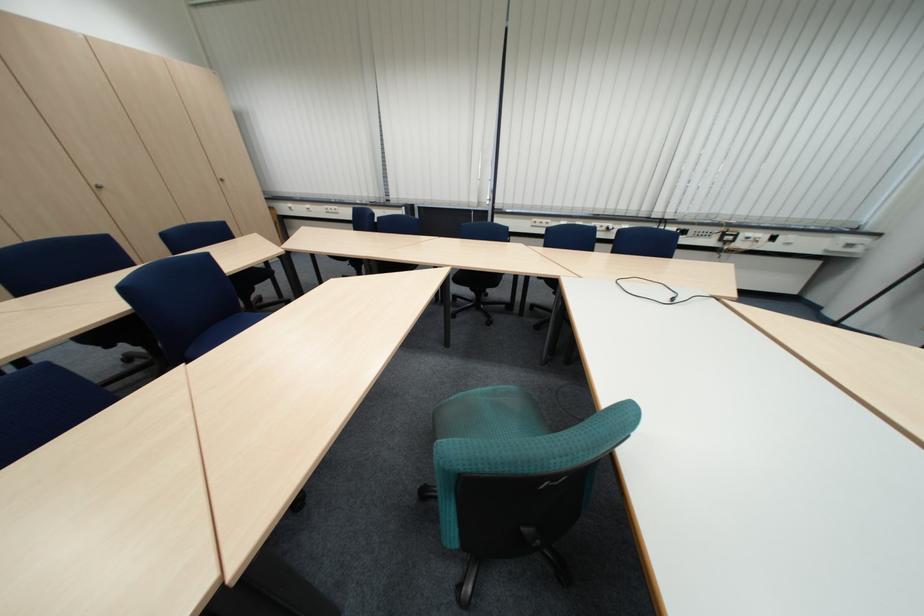
The height and width of the screenshot is (616, 924). What do you see at coordinates (663, 293) in the screenshot?
I see `a blind adjustment wand` at bounding box center [663, 293].